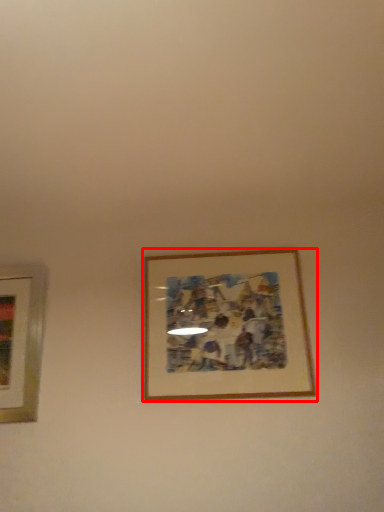
Question: From the image's perspective, what is the correct spatial positioning of picture frame (annotated by the red box) in reference to picture frame?

Choices:
 (A) below
 (B) above

Answer: (B)